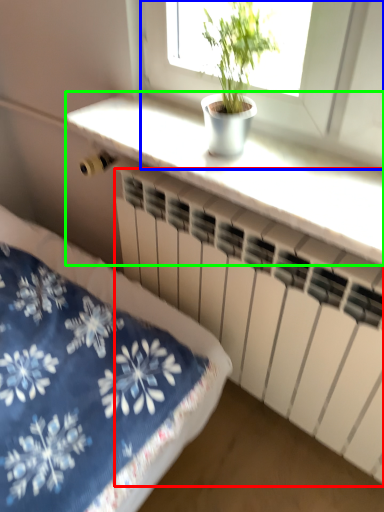
Question: Which is nearer to the radiator (highlighted by a red box)? window (highlighted by a blue box) or counter top (highlighted by a green box).

Choices:
 (A) window
 (B) counter top

Answer: (B)